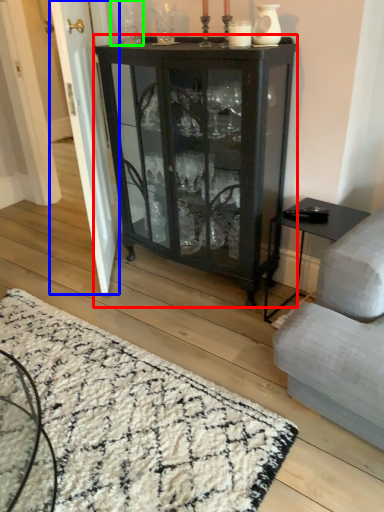
Question: Estimate the real-world distances between objects in this image. Which object is farther from cupboard (highlighted by a red box), screen door (highlighted by a blue box) or glass vase (highlighted by a green box)?

Choices:
 (A) screen door
 (B) glass vase

Answer: (B)